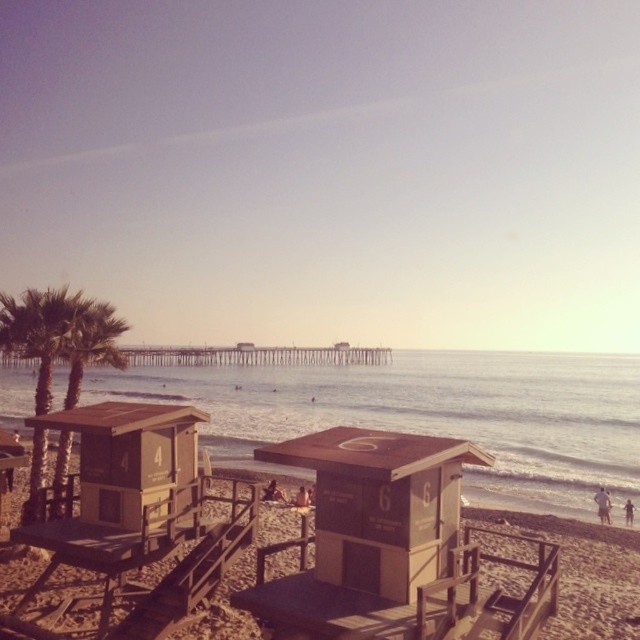
You are standing on the brown sandy beach at center and want to look up at the green leafy palm tree at left. In which direction should you turn your head?

You should look upward because the brown sandy beach at center is below the green leafy palm tree at left.

You are standing at the point labeled as point (285, 579) in the image. What is the name of the location you are currently standing on?

The point (285, 579) indicates the brown sandy beach at center.